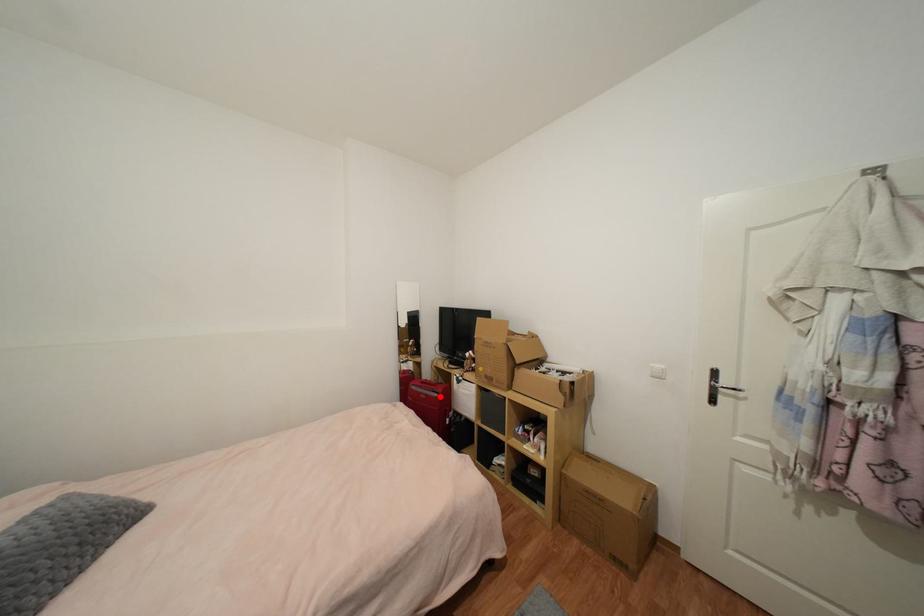
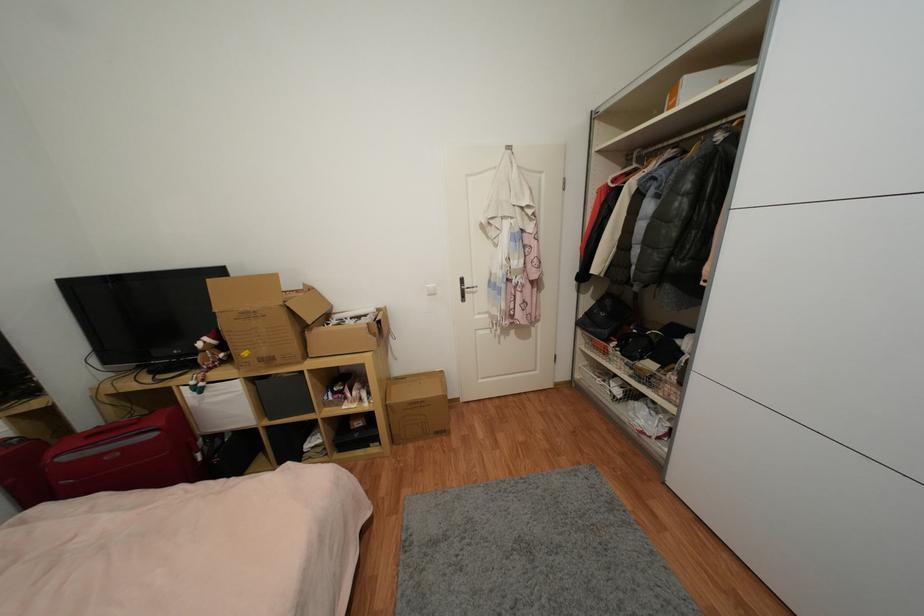
Question: I am providing you with two images of the same scene from different viewpoints. A red point is marked on the first image. Can you still see the location of the red point in image 2?

Choices:
 (A) Yes
 (B) No

Answer: (A)